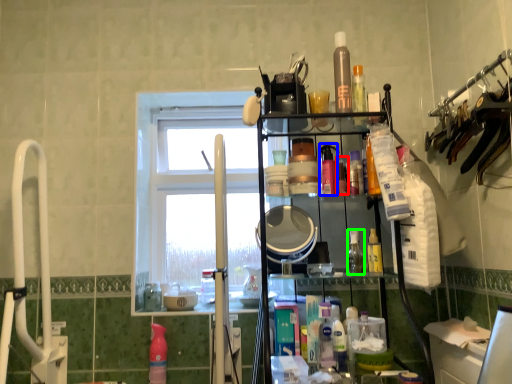
Question: Which object is positioned farthest from toiletry (highlighted by a red box)? Select from toiletry (highlighted by a blue box) and toiletry (highlighted by a green box).

Choices:
 (A) toiletry
 (B) toiletry

Answer: (B)